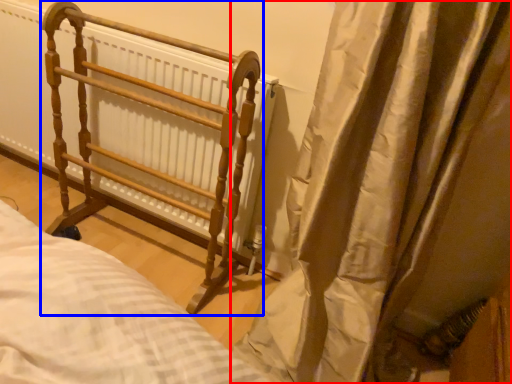
Question: Which object appears farthest to the camera in this image, curtain (highlighted by a red box) or furniture (highlighted by a blue box)?

Choices:
 (A) curtain
 (B) furniture

Answer: (B)